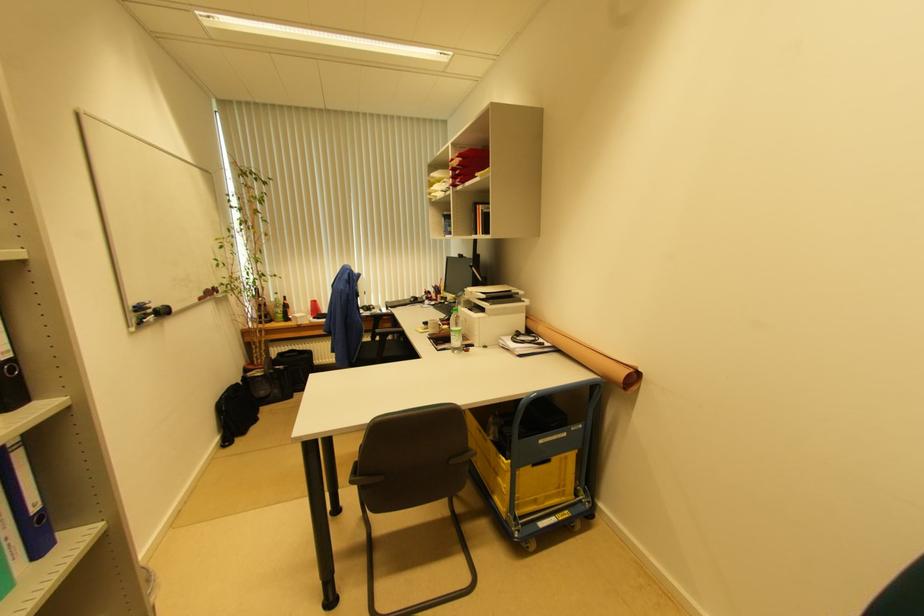
The image size is (924, 616). I want to click on plastic water bottle, so click(x=456, y=330).